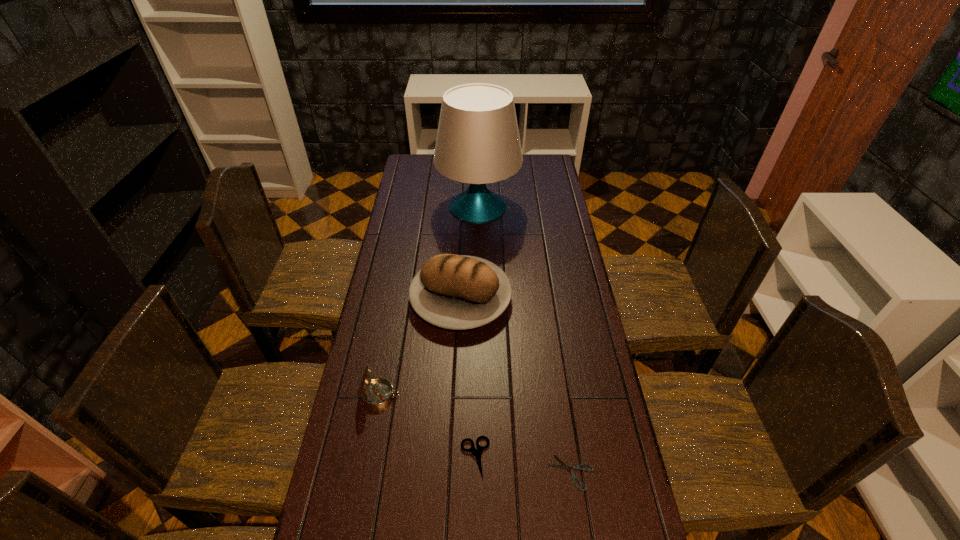
Where is `vacant space located 0.220m on the front-facing side of the table lamp`? The width and height of the screenshot is (960, 540). vacant space located 0.220m on the front-facing side of the table lamp is located at coordinates (478, 267).

Image resolution: width=960 pixels, height=540 pixels. I want to click on vacant space located on the back of the fourth shortest object, so click(x=464, y=236).

You are a GUI agent. You are given a task and a screenshot of the screen. Output one action in this format:
    pyautogui.click(x=<x>, y=<y>)
    Task: Click on the vacant space situated 0.190m with the dial facing the third tallest object
    The height and width of the screenshot is (540, 960).
    Given the screenshot: What is the action you would take?
    pyautogui.click(x=463, y=395)

Identify the location of vacant space located 0.300m on the left of the taller shears. (348, 457).

Identify the location of free region located 0.330m on the back of the shorter shears. The width and height of the screenshot is (960, 540). coord(554,353).

You are a GUI agent. You are given a task and a screenshot of the screen. Output one action in this format:
    pyautogui.click(x=<x>, y=<y>)
    Task: Click on the bread at the left edge
    This screenshot has height=540, width=960.
    Given the screenshot: What is the action you would take?
    pyautogui.click(x=458, y=292)

Locate an element on the screen. The image size is (960, 540). compass at the left edge is located at coordinates (376, 393).

The height and width of the screenshot is (540, 960). I want to click on object that is at the right edge, so click(x=565, y=466).

Find the location of a particular element. vacant region at the left edge of the desktop is located at coordinates (423, 262).

I want to click on vacant space at the right edge of the desktop, so click(x=585, y=319).